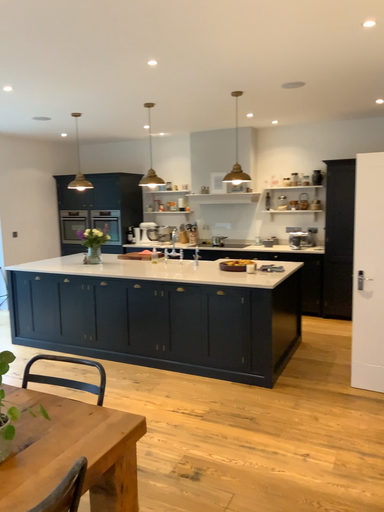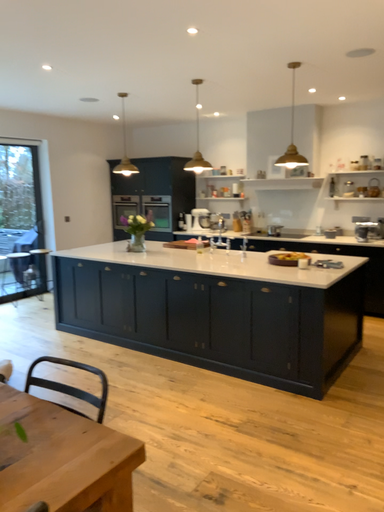
Question: Which way did the camera rotate in the video?

Choices:
 (A) rotated left
 (B) rotated right

Answer: (A)